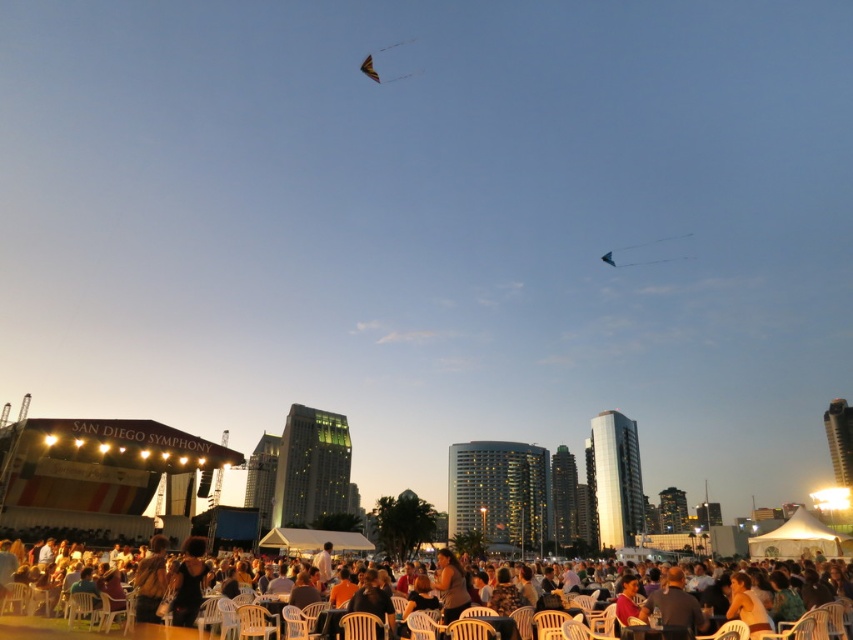
Question: Is white plastic chairs at lower center positioned before translucent blue kite at upper right?

Choices:
 (A) yes
 (B) no

Answer: (A)

Question: Is blonde hair at center to the right of translucent blue kite at upper right from the viewer's perspective?

Choices:
 (A) yes
 (B) no

Answer: (B)

Question: Which of the following is the farthest from the observer?

Choices:
 (A) white plastic chairs at lower center
 (B) multicolored fabric kite at upper center

Answer: (B)

Question: Which point is farther to the camera?

Choices:
 (A) (444, 600)
 (B) (646, 243)

Answer: (B)

Question: Does white plastic chairs at lower center appear on the left side of translucent blue kite at upper right?

Choices:
 (A) yes
 (B) no

Answer: (A)

Question: Estimate the real-world distances between objects in this image. Which object is farther from the white plastic chairs at lower center?

Choices:
 (A) translucent blue kite at upper right
 (B) blonde hair at center
 (C) multicolored fabric kite at upper center

Answer: (C)